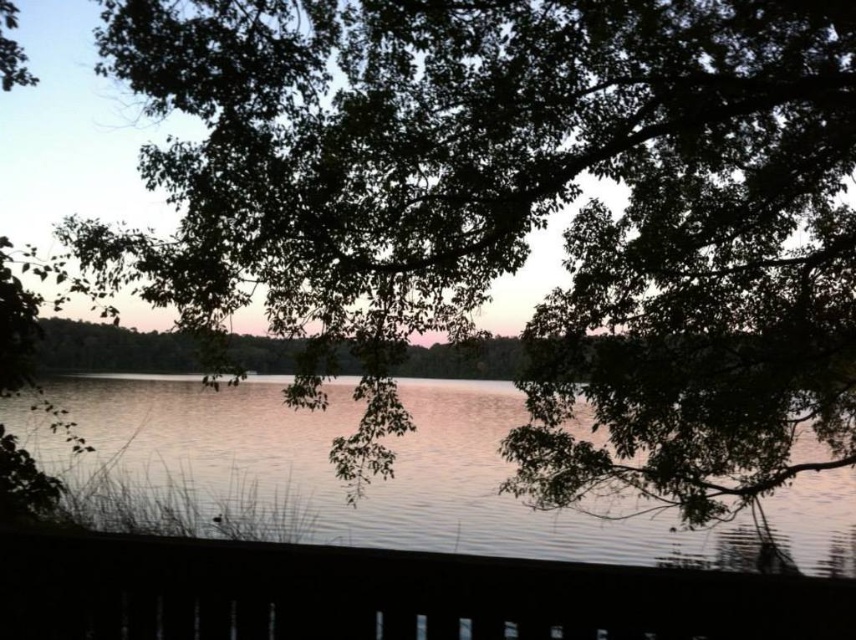
Based on the photo, you are standing at the edge of the lake and want to walk to the smooth wooden deck at lower center. According to the coordinates provided, is the deck closer to the water or the distant shoreline?

The smooth wooden deck at lower center is located at point 0.930 on the x and 0.449 on the y axis. Since the coordinates are closer to the lower center, the deck is closer to the water than the distant shoreline.

You are standing on the smooth wooden deck at lower center and want to walk to the silvery reflective water at center. Which direction should you move to reach the water?

The smooth wooden deck at lower center is to the left of silvery reflective water at center, so you should move to the right to reach the water.

You are standing at the point with coordinates point (383,595). Based on the scene, what is the object you are standing on?

The point (383,595) corresponds to smooth wooden deck at lower center according to the objects description.